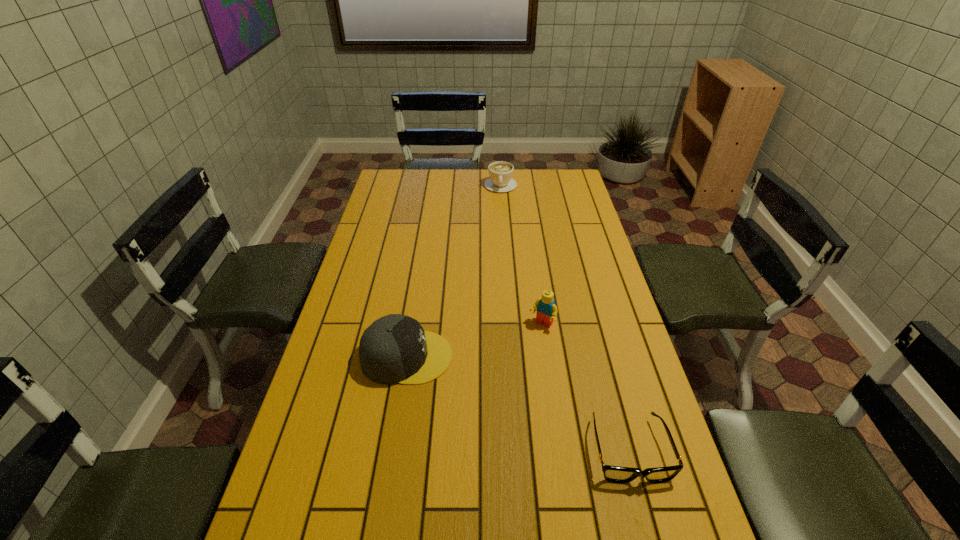
Locate an element on the screen. vacant space at the far left corner is located at coordinates (410, 178).

The height and width of the screenshot is (540, 960). Identify the location of free space at the far right corner. (568, 173).

Where is `empty space that is in between the cappuccino and the leftmost object`? This screenshot has height=540, width=960. empty space that is in between the cappuccino and the leftmost object is located at coordinates (454, 271).

Locate an element on the screen. This screenshot has width=960, height=540. vacant space in between the farthest object and the rightmost object is located at coordinates (564, 318).

Where is `free spot between the Lego and the second shortest object`? The height and width of the screenshot is (540, 960). free spot between the Lego and the second shortest object is located at coordinates (521, 255).

At what (x,y) coordinates should I click in order to perform the action: click on vacant point located between the cap and the rightmost object. Please return your answer as a coordinate pair (x, y). Looking at the image, I should click on pyautogui.click(x=518, y=403).

Where is `vacant space that is in between the Lego and the nearest object`? vacant space that is in between the Lego and the nearest object is located at coordinates (586, 388).

I want to click on free space between the leftmost object and the Lego, so click(x=474, y=341).

What are the coordinates of `free area in between the Lego and the rightmost object` in the screenshot? It's located at (586, 388).

Find the location of a particular element. empty space that is in between the sunglasses and the farthest object is located at coordinates (564, 318).